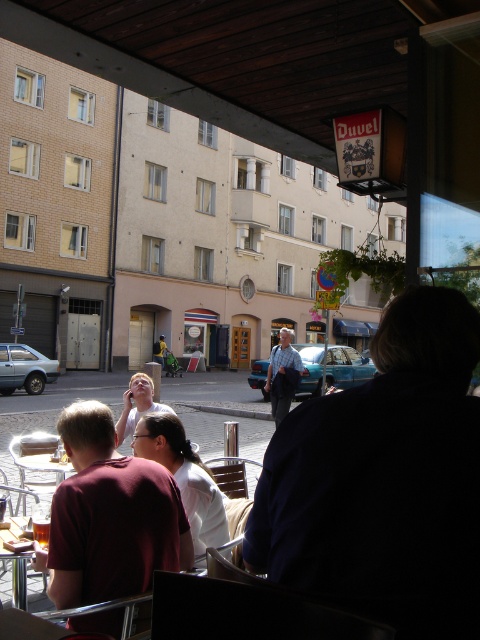
Is point (69, 420) behind point (120, 416)?

No, (69, 420) is in front of (120, 416).

How distant is maroon shirt at center from light brown hair at center?

1.87 meters

Who is more forward, (156, 509) or (131, 390)?

Point (156, 509)

Locate an element on the screen. The width and height of the screenshot is (480, 640). maroon shirt at center is located at coordinates (109, 516).

In the scene shown: Measure the distance between point [283,333] and camera.

Point [283,333] and camera are 11.31 meters apart from each other.

Is light blue shirt at center to the right of light brown hair at center from the viewer's perspective?

Yes, light blue shirt at center is to the right of light brown hair at center.

Which is behind, point (294, 392) or point (148, 392)?

Point (294, 392)

This screenshot has width=480, height=640. Find the location of `light blue shirt at center`. light blue shirt at center is located at coordinates (283, 376).

Does light blue shirt at center have a greater height compared to wooden table at lower left?

Indeed, light blue shirt at center has a greater height compared to wooden table at lower left.

Is light blue shirt at center positioned in front of wooden table at lower left?

That is False.

Is point (271, 396) closer to camera compared to point (24, 568)?

No, (271, 396) is further to viewer.

Image resolution: width=480 pixels, height=640 pixels. I want to click on light blue shirt at center, so click(x=283, y=376).